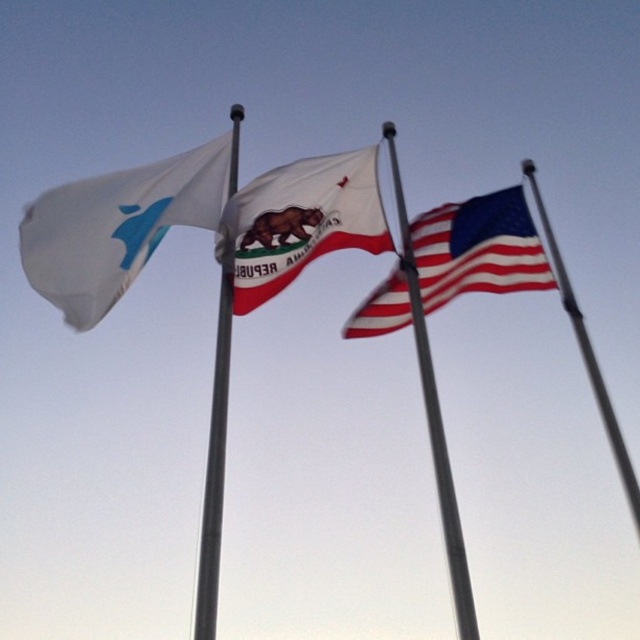
Which of these two, american flag at center or silver metallic flag pole at center, stands shorter?

american flag at center is shorter.

Does point (476, 240) come farther from viewer compared to point (212, 484)?

That is True.

This screenshot has height=640, width=640. Find the location of `american flag at center`. american flag at center is located at coordinates (477, 248).

Can you confirm if silver metallic flag pole at center is thinner than metallic silver flag pole at center?

In fact, silver metallic flag pole at center might be wider than metallic silver flag pole at center.

Is silver metallic flag pole at center below metallic silver flag pole at center?

Indeed, silver metallic flag pole at center is positioned under metallic silver flag pole at center.

Is point (196, 621) more distant than point (445, 547)?

No.

You are a GUI agent. You are given a task and a screenshot of the screen. Output one action in this format:
    pyautogui.click(x=<x>, y=<y>)
    Task: Click on the silver metallic flag pole at center
    
    Given the screenshot: What is the action you would take?
    pyautogui.click(x=214, y=465)

Is point (86, 189) positioned in front of point (308, 173)?

No, it is not.

Which is below, white fabric flag at left or white cotton flag at center?

white cotton flag at center is below.

Describe the element at coordinates (116, 227) in the screenshot. The height and width of the screenshot is (640, 640). I see `white fabric flag at left` at that location.

The height and width of the screenshot is (640, 640). Identify the location of white fabric flag at left. (116, 227).